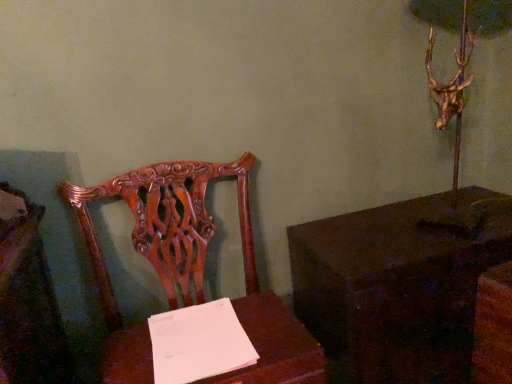
Find the location of a particular element. This screenshot has width=512, height=384. free space above wooden table at center, which is the first table from left to right (from a real-world perspective) is located at coordinates (202, 345).